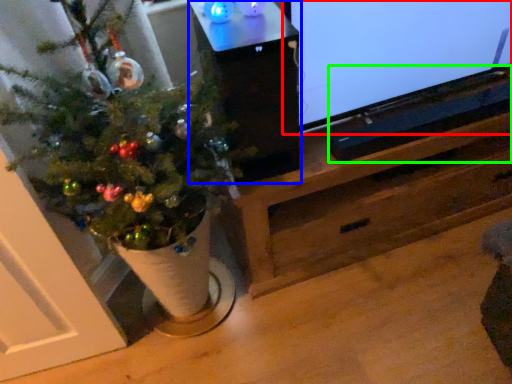
Question: Which is farther away from television (highlighted by a red box)? table (highlighted by a blue box) or wide (highlighted by a green box)?

Choices:
 (A) table
 (B) wide

Answer: (A)